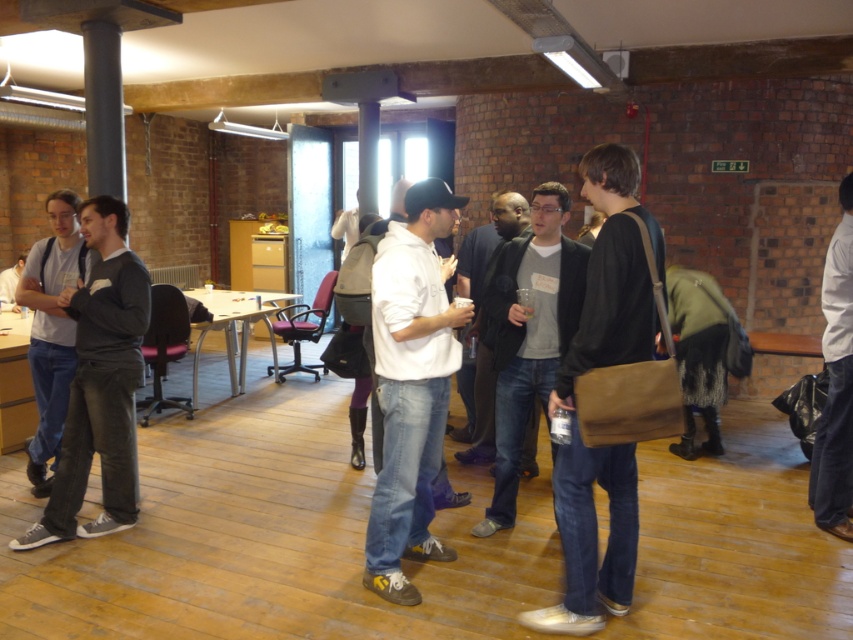
You are organizing a clothing donation drive and need to sort items by size. You have a dark gray jeans at left and a gray cotton hoodie at center. Which item should you place in the large size bin?

The dark gray jeans at left is larger in size than the gray cotton hoodie at center, so you should place the dark gray jeans at left in the large size bin.

You are a photographer at the event and need to capture a photo of both the dark gray jeans at left and dark gray jeans at center. Which pair of jeans should you focus on first to ensure they are both in frame without moving the camera?

You should focus on the dark gray jeans at center first because it is larger than the dark gray jeans at left, ensuring both can fit within the camera frame when starting with the larger one.